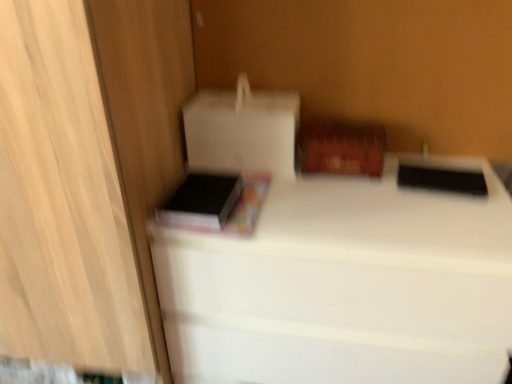
In order to face white matte bed at center, should I rotate leftwards or rightwards?

Rotate your view right by about 9.752°.

The width and height of the screenshot is (512, 384). I want to click on white matte cardboard box at upper left, marked as the 2th cardboard box in a right-to-left arrangement, so click(242, 130).

What is the approximate width of matte wood cabinet at left?

matte wood cabinet at left is 25.92 inches in width.

In order to click on white matte bed at center in this screenshot , I will do `click(345, 286)`.

Considering the sizes of objects white matte cardboard box at upper left, marked as the 2th cardboard box in a right-to-left arrangement, and black matte book at left in the image provided, who is shorter, white matte cardboard box at upper left, marked as the 2th cardboard box in a right-to-left arrangement, or black matte book at left?

Standing shorter between the two is black matte book at left.

In the scene shown: How different are the orientations of white matte cardboard box at upper left, marked as the 2th cardboard box in a right-to-left arrangement, and black matte book at left in degrees?

white matte cardboard box at upper left, marked as the 2th cardboard box in a right-to-left arrangement, and black matte book at left are facing 3.16 degrees away from each other.

Looking at this image, which is closer to the camera, (184, 113) or (215, 213)?

Point (184, 113) is positioned farther from the camera compared to point (215, 213).

Which of these two, white matte cardboard box at upper left, which is counted as the first cardboard box, starting from the left, or black matte book at left, is wider?

black matte book at left is wider.

Looking at the image, does cardboard box at upper right, the 2th cardboard box viewed from the left, seem bigger or smaller compared to black matte book at left?

cardboard box at upper right, the 2th cardboard box viewed from the left, is bigger than black matte book at left.

Find the location of `book below the cardboard box at upper right, the 2th cardboard box viewed from the left (from a real-world perspective)`. book below the cardboard box at upper right, the 2th cardboard box viewed from the left (from a real-world perspective) is located at coordinates 215,203.

Based on the photo, is cardboard box at upper right, the 2th cardboard box viewed from the left, turned away from black matte book at left?

No, black matte book at left is not at the back of cardboard box at upper right, the 2th cardboard box viewed from the left.

From a real-world perspective, which object stands above the other?

In real-world perspective, cardboard box at upper right, marked as the 1th cardboard box in a right-to-left arrangement, is above.

You are a GUI agent. You are given a task and a screenshot of the screen. Output one action in this format:
    pyautogui.click(x=<x>, y=<y>)
    Task: Click on the cabinetry in front of the black matte book at left
    
    Given the screenshot: What is the action you would take?
    pyautogui.click(x=62, y=200)

Could you tell me if matte wood cabinet at left is turned towards black matte book at left?

No.

Considering the relative sizes of matte wood cabinet at left and black matte book at left in the image provided, is matte wood cabinet at left bigger than black matte book at left?

Yes.

Considering the positions of objects matte wood cabinet at left and black matte book at left in the image provided, who is behind, matte wood cabinet at left or black matte book at left?

black matte book at left is further from the camera.

Could you tell me if white matte bed at center is facing matte wood cabinet at left?

No, white matte bed at center is not aimed at matte wood cabinet at left.

From the picture: Is white matte bed at center at the left side of matte wood cabinet at left?

In fact, white matte bed at center is to the right of matte wood cabinet at left.

Are white matte bed at center and matte wood cabinet at left beside each other?

No, white matte bed at center is not next to matte wood cabinet at left.

Is point (422, 213) closer to camera compared to point (9, 117)?

No, (422, 213) is behind (9, 117).

Where is `cabinetry below the cardboard box at upper right, the 2th cardboard box viewed from the left (from the image's perspective)`? The height and width of the screenshot is (384, 512). cabinetry below the cardboard box at upper right, the 2th cardboard box viewed from the left (from the image's perspective) is located at coordinates (62, 200).

Can you confirm if cardboard box at upper right, the 2th cardboard box viewed from the left, is positioned to the left of matte wood cabinet at left?

In fact, cardboard box at upper right, the 2th cardboard box viewed from the left, is to the right of matte wood cabinet at left.

How much distance is there between cardboard box at upper right, the 2th cardboard box viewed from the left, and matte wood cabinet at left?

A distance of 59.03 centimeters exists between cardboard box at upper right, the 2th cardboard box viewed from the left, and matte wood cabinet at left.

From a real-world perspective, which is physically above, cardboard box at upper right, marked as the 1th cardboard box in a right-to-left arrangement, or matte wood cabinet at left?

In real-world perspective, cardboard box at upper right, marked as the 1th cardboard box in a right-to-left arrangement, is above.

Is point (218, 191) farther from viewer compared to point (378, 171)?

No, it is in front of (378, 171).

I want to click on book below the cardboard box at upper right, the 2th cardboard box viewed from the left (from the image's perspective), so click(215, 203).

Is black matte book at left smaller than cardboard box at upper right, marked as the 1th cardboard box in a right-to-left arrangement?

Yes.

Is black matte book at left completely or partially outside of cardboard box at upper right, marked as the 1th cardboard box in a right-to-left arrangement?

black matte book at left lies outside cardboard box at upper right, marked as the 1th cardboard box in a right-to-left arrangement,'s area.

Is point (269, 167) closer or farther from the camera than point (315, 365)?

Point (269, 167) is positioned farther from the camera compared to point (315, 365).

In the image, is white matte cardboard box at upper left, which is counted as the first cardboard box, starting from the left, positioned in front of or behind white matte bed at center?

white matte cardboard box at upper left, which is counted as the first cardboard box, starting from the left, is positioned farther from the viewer than white matte bed at center.

Which is correct: white matte cardboard box at upper left, marked as the 2th cardboard box in a right-to-left arrangement, is inside white matte bed at center, or outside of it?

white matte cardboard box at upper left, marked as the 2th cardboard box in a right-to-left arrangement, lies outside white matte bed at center.

What's the angular difference between white matte cardboard box at upper left, marked as the 2th cardboard box in a right-to-left arrangement, and white matte bed at center's facing directions?

There is a 0.377-degree angle between the facing directions of white matte cardboard box at upper left, marked as the 2th cardboard box in a right-to-left arrangement, and white matte bed at center.

Locate an element on the screen. The image size is (512, 384). the 1st cardboard box behind the black matte book at left, counting from the anchor's position is located at coordinates (242, 130).

Where is `book in front of the cardboard box at upper right, the 2th cardboard box viewed from the left`? book in front of the cardboard box at upper right, the 2th cardboard box viewed from the left is located at coordinates (215, 203).

When comparing their distances from white matte cardboard box at upper left, marked as the 2th cardboard box in a right-to-left arrangement, does black matte book at left or matte wood cabinet at left seem further?

matte wood cabinet at left.

Looking at the image, which one is located closer to cardboard box at upper right, the 2th cardboard box viewed from the left, white matte bed at center or white matte cardboard box at upper left, which is counted as the first cardboard box, starting from the left?

white matte cardboard box at upper left, which is counted as the first cardboard box, starting from the left, is closer to cardboard box at upper right, the 2th cardboard box viewed from the left.

When comparing their distances from white matte cardboard box at upper left, which is counted as the first cardboard box, starting from the left, does cardboard box at upper right, the 2th cardboard box viewed from the left, or matte wood cabinet at left seem closer?

cardboard box at upper right, the 2th cardboard box viewed from the left, is closer to white matte cardboard box at upper left, which is counted as the first cardboard box, starting from the left.

Which object lies nearer to the anchor point matte wood cabinet at left, white matte cardboard box at upper left, marked as the 2th cardboard box in a right-to-left arrangement, or black matte book at left?

black matte book at left is positioned closer to the anchor matte wood cabinet at left.

Estimate the real-world distances between objects in this image. Which object is further from matte wood cabinet at left, cardboard box at upper right, the 2th cardboard box viewed from the left, or black matte book at left?

cardboard box at upper right, the 2th cardboard box viewed from the left.

When comparing their distances from white matte bed at center, does cardboard box at upper right, the 2th cardboard box viewed from the left, or white matte cardboard box at upper left, which is counted as the first cardboard box, starting from the left, seem closer?

cardboard box at upper right, the 2th cardboard box viewed from the left.

From the image, which object appears to be nearer to cardboard box at upper right, marked as the 1th cardboard box in a right-to-left arrangement, matte wood cabinet at left or white matte cardboard box at upper left, which is counted as the first cardboard box, starting from the left?

white matte cardboard box at upper left, which is counted as the first cardboard box, starting from the left, is positioned closer to the anchor cardboard box at upper right, marked as the 1th cardboard box in a right-to-left arrangement.

From the image, which object appears to be nearer to matte wood cabinet at left, white matte cardboard box at upper left, marked as the 2th cardboard box in a right-to-left arrangement, or cardboard box at upper right, the 2th cardboard box viewed from the left?

white matte cardboard box at upper left, marked as the 2th cardboard box in a right-to-left arrangement, is closer to matte wood cabinet at left.

Image resolution: width=512 pixels, height=384 pixels. I want to click on cardboard box between matte wood cabinet at left and white matte bed at center in the horizontal direction, so [x=242, y=130].

Locate an element on the screen. book between matte wood cabinet at left and white matte bed at center in the horizontal direction is located at coordinates (215, 203).

Locate an element on the screen. cardboard box between white matte cardboard box at upper left, marked as the 2th cardboard box in a right-to-left arrangement, and white matte bed at center vertically is located at coordinates click(340, 148).

Locate an element on the screen. Image resolution: width=512 pixels, height=384 pixels. furniture situated between matte wood cabinet at left and cardboard box at upper right, the 2th cardboard box viewed from the left, from left to right is located at coordinates (345, 286).